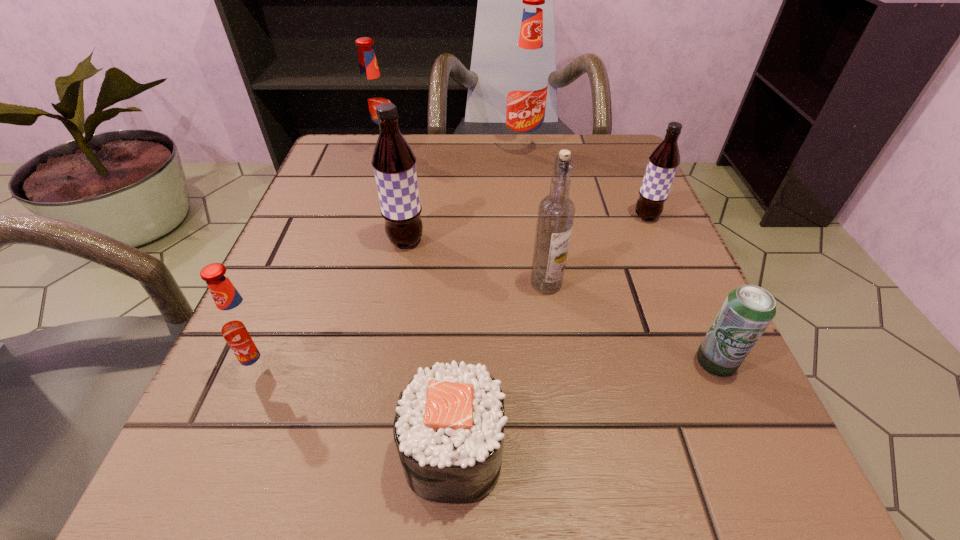
This screenshot has width=960, height=540. I want to click on free region located on the left of the beer can, so click(x=443, y=362).

Image resolution: width=960 pixels, height=540 pixels. What are the coordinates of `vacant space situated on the left of the fourth object from left to right` in the screenshot? It's located at (195, 454).

You are a GUI agent. You are given a task and a screenshot of the screen. Output one action in this format:
    pyautogui.click(x=<x>, y=<y>)
    Task: Click on the object positioned at the near edge
    
    Given the screenshot: What is the action you would take?
    pyautogui.click(x=449, y=423)

Where is `root beer that is at the right edge`? The width and height of the screenshot is (960, 540). root beer that is at the right edge is located at coordinates (663, 162).

I want to click on beer can that is at the right edge, so click(747, 311).

Image resolution: width=960 pixels, height=540 pixels. I want to click on object that is at the far left corner, so click(372, 93).

Locate an element on the screen. free space at the far edge is located at coordinates (468, 160).

Where is `vacant region at the near edge of the desktop`? The image size is (960, 540). vacant region at the near edge of the desktop is located at coordinates (316, 518).

Locate an element on the screen. free region at the left edge is located at coordinates (283, 244).

What are the coordinates of `free spot at the right edge of the desktop` in the screenshot? It's located at (651, 252).